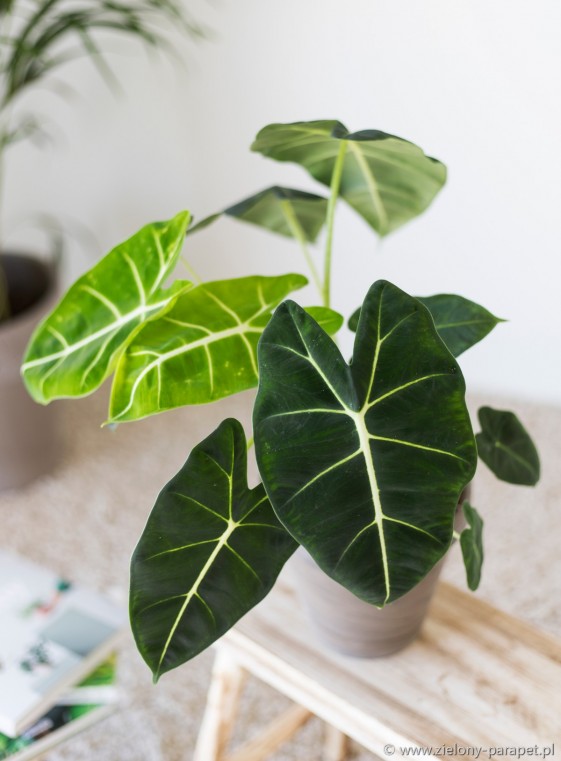
The width and height of the screenshot is (561, 761). Find the location of `long green plant`. long green plant is located at coordinates (35, 37).